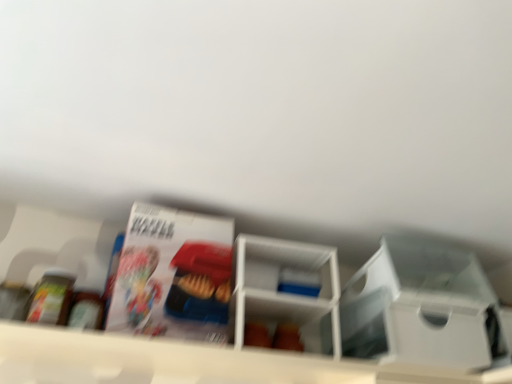
Question: Does white plastic shelf at center, the second shelf from the right, touch white glossy magazine at upper center?

Choices:
 (A) no
 (B) yes

Answer: (A)

Question: Is white glossy magazine at upper center a part of white plastic shelf at center, the second shelf from the right?

Choices:
 (A) no
 (B) yes

Answer: (A)

Question: Is there a large distance between white plastic shelf at center, the second shelf from the right, and white glossy magazine at upper center?

Choices:
 (A) yes
 (B) no

Answer: (B)

Question: Does white plastic shelf at center, the second shelf from the right, have a larger size compared to white glossy magazine at upper center?

Choices:
 (A) no
 (B) yes

Answer: (A)

Question: Is white plastic shelf at center, placed as the first shelf when sorted from left to right, facing away from white glossy magazine at upper center?

Choices:
 (A) no
 (B) yes

Answer: (A)

Question: Is white plastic shelf at center, placed as the first shelf when sorted from left to right, aimed at white glossy magazine at upper center?

Choices:
 (A) no
 (B) yes

Answer: (A)

Question: Can you confirm if white plastic shelf at center, which is counted as the first shelf, starting from the right, is shorter than white plastic storage box at center-right?

Choices:
 (A) no
 (B) yes

Answer: (A)

Question: Is white plastic shelf at center, which is counted as the first shelf, starting from the right, facing away from white plastic storage box at center-right?

Choices:
 (A) no
 (B) yes

Answer: (A)

Question: Is white plastic shelf at center, which is counted as the first shelf, starting from the right, far from white plastic storage box at center-right?

Choices:
 (A) yes
 (B) no

Answer: (B)

Question: Does white plastic shelf at center, which is counted as the first shelf, starting from the right, have a smaller size compared to white plastic storage box at center-right?

Choices:
 (A) no
 (B) yes

Answer: (A)

Question: From the image's perspective, is white plastic shelf at center, which is counted as the first shelf, starting from the right, over white plastic storage box at center-right?

Choices:
 (A) no
 (B) yes

Answer: (A)

Question: Is white plastic shelf at center, positioned as the second shelf in left-to-right order, positioned behind white plastic storage box at center-right?

Choices:
 (A) yes
 (B) no

Answer: (B)

Question: Is the position of white plastic shelf at center, which is counted as the first shelf, starting from the right, more distant than that of white plastic shelf at center, placed as the first shelf when sorted from left to right?

Choices:
 (A) yes
 (B) no

Answer: (A)